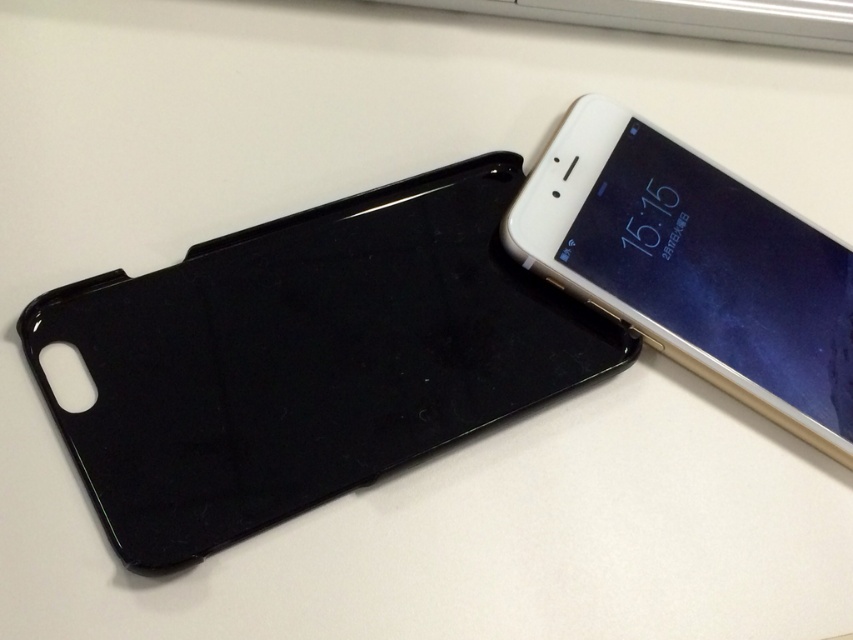
Question: Observing the image, what is the correct spatial positioning of black matte phone case at lower left in reference to white glossy smartphone at upper right?

Choices:
 (A) left
 (B) right

Answer: (A)

Question: Which object is farther from the camera taking this photo?

Choices:
 (A) white glossy smartphone at upper right
 (B) black matte phone case at lower left

Answer: (A)

Question: Which point appears closest to the camera in this image?

Choices:
 (A) (544, 260)
 (B) (276, 342)

Answer: (B)

Question: Does black matte phone case at lower left have a lesser width compared to white glossy smartphone at upper right?

Choices:
 (A) no
 (B) yes

Answer: (A)

Question: Does black matte phone case at lower left have a greater width compared to white glossy smartphone at upper right?

Choices:
 (A) yes
 (B) no

Answer: (A)